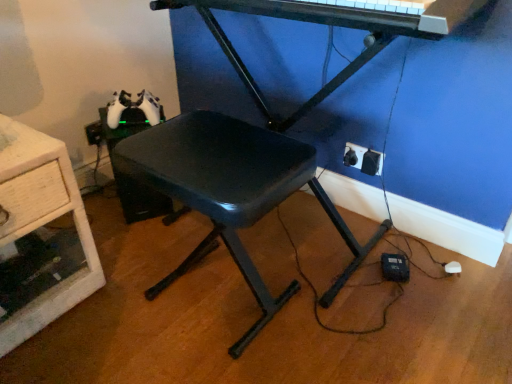
Locate an element on the screen. This screenshot has height=384, width=512. vacant space situated on the left part of black plastic stool at center is located at coordinates (111, 304).